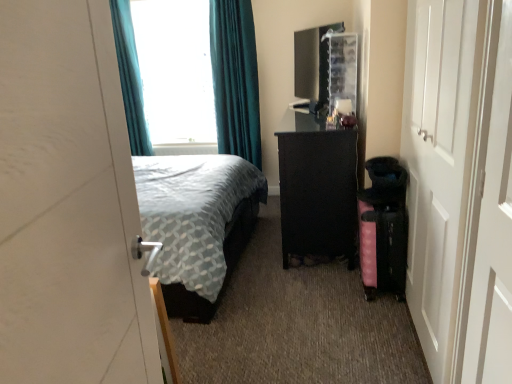
Find the location of a particular element. The width and height of the screenshot is (512, 384). blank area to the left of pink fabric suitcase at lower right is located at coordinates (334, 292).